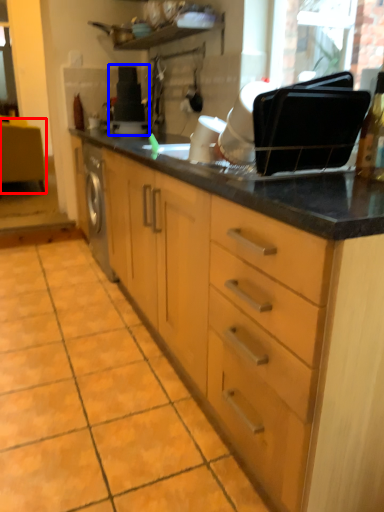
Question: Which of the following is the closest to the observer, vanity (highlighted by a red box) or appliance (highlighted by a blue box)?

Choices:
 (A) vanity
 (B) appliance

Answer: (B)